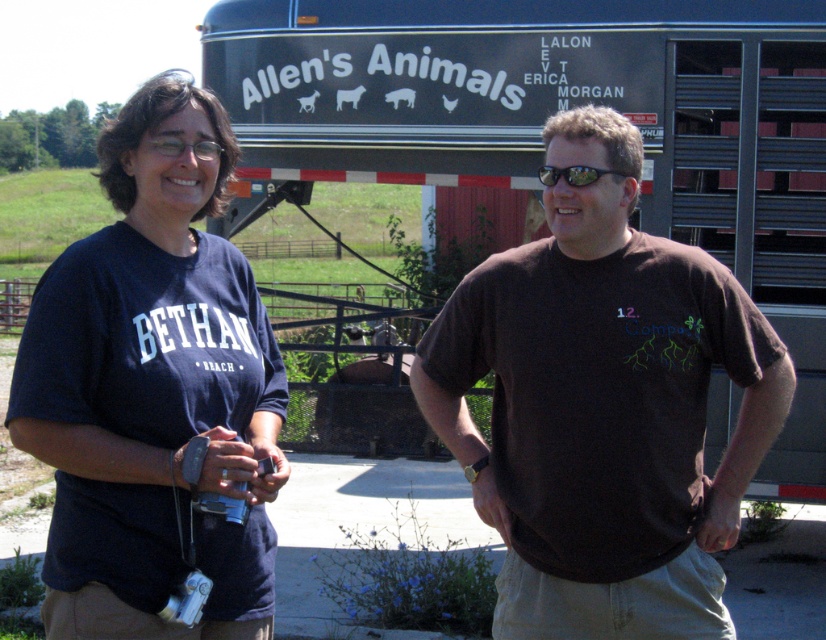
Question: Which of the following is the farthest from the observer?

Choices:
 (A) (544, 177)
 (B) (211, 422)
 (C) (795, 282)

Answer: (C)

Question: Can you confirm if brown cotton t-shirt at center is positioned to the right of dark blue t-shirt at left?

Choices:
 (A) yes
 (B) no

Answer: (A)

Question: Does black trailer truck at center appear over black reflective sunglasses at center?

Choices:
 (A) yes
 (B) no

Answer: (A)

Question: Which is nearer to the dark blue t-shirt at left?

Choices:
 (A) black reflective sunglasses at center
 (B) brown cotton t-shirt at center

Answer: (B)

Question: Which object is closer to the camera taking this photo?

Choices:
 (A) dark blue t-shirt at left
 (B) black trailer truck at center
 (C) brown cotton t-shirt at center

Answer: (A)

Question: Can you confirm if brown cotton t-shirt at center is thinner than dark blue t-shirt at left?

Choices:
 (A) no
 (B) yes

Answer: (A)